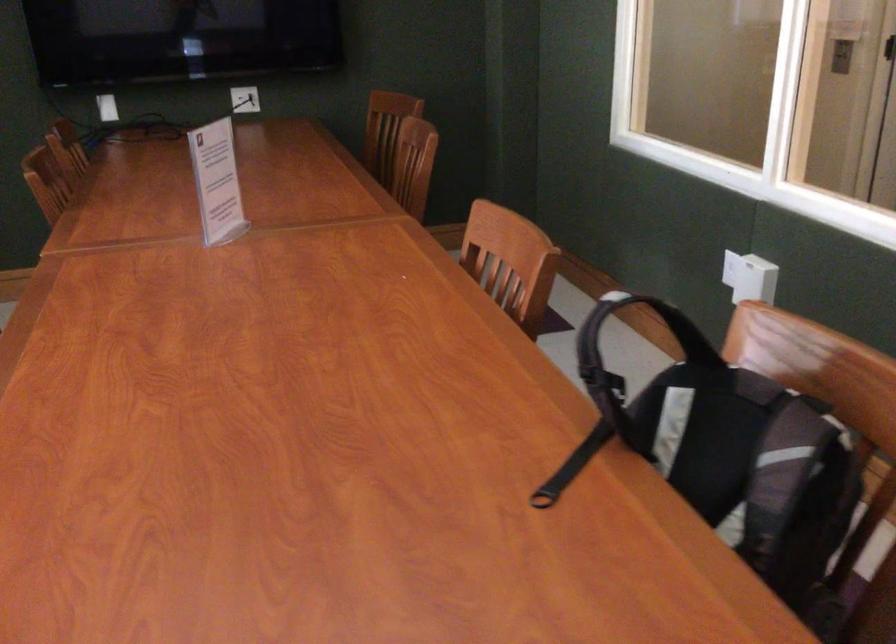
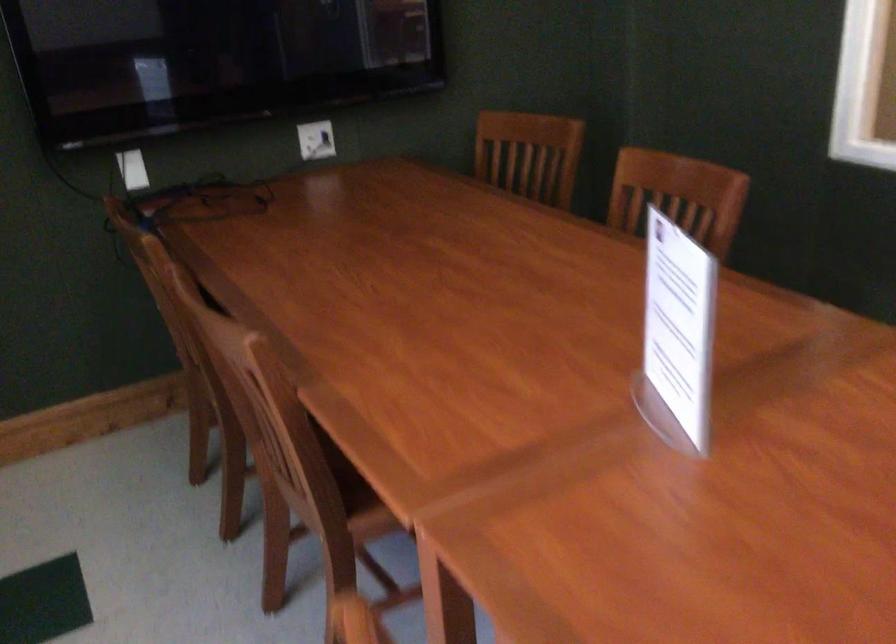
Where in the second image is the point corresponding to point (225, 185) from the first image?

(677, 335)